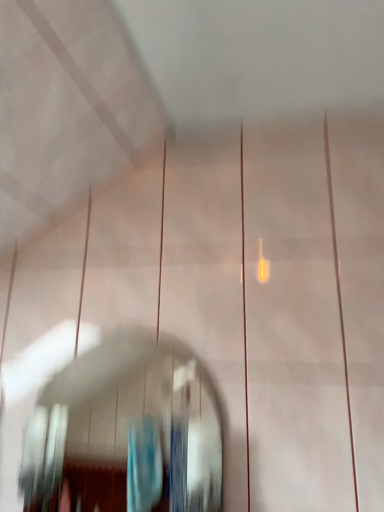
What do you see at coordinates (126, 431) in the screenshot? Image resolution: width=384 pixels, height=512 pixels. I see `shiny metallic mirror at center` at bounding box center [126, 431].

This screenshot has height=512, width=384. Identify the location of shiny metallic mirror at center. (126, 431).

Where is `shiny metallic mirror at center`? The height and width of the screenshot is (512, 384). shiny metallic mirror at center is located at coordinates (126, 431).